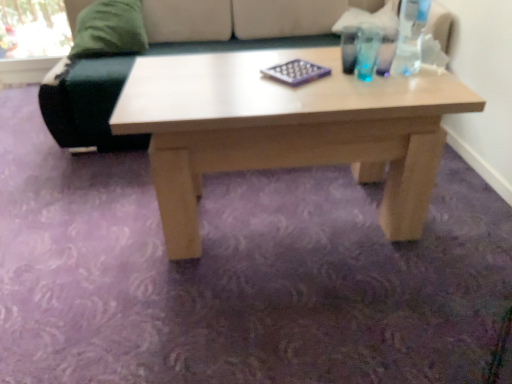
I want to click on vacant area that is in front of velvet green couch at upper left, so click(238, 241).